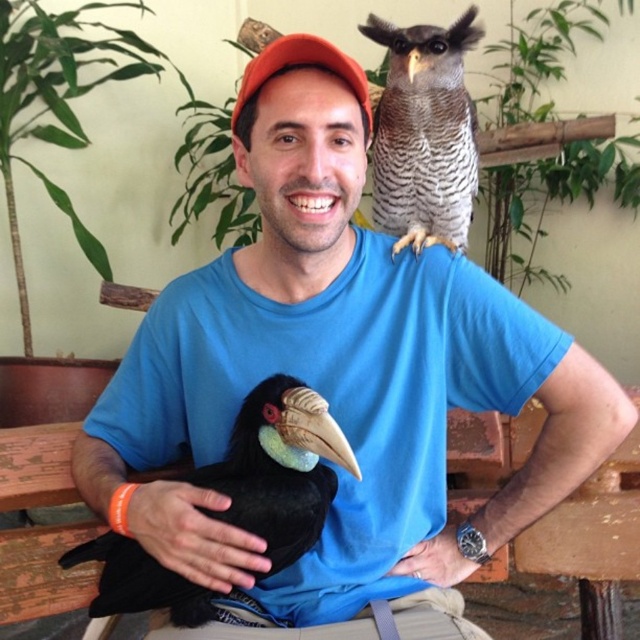
You are a park ranger trying to locate the black matte hornbill at lower left. According to the coordinates provided, where exactly is the hornbill positioned in the image?

The black matte hornbill at lower left is located at point (278,468), which means it is positioned approximately 73.3 percent from the left edge and 43.6 percent from the bottom of the image.